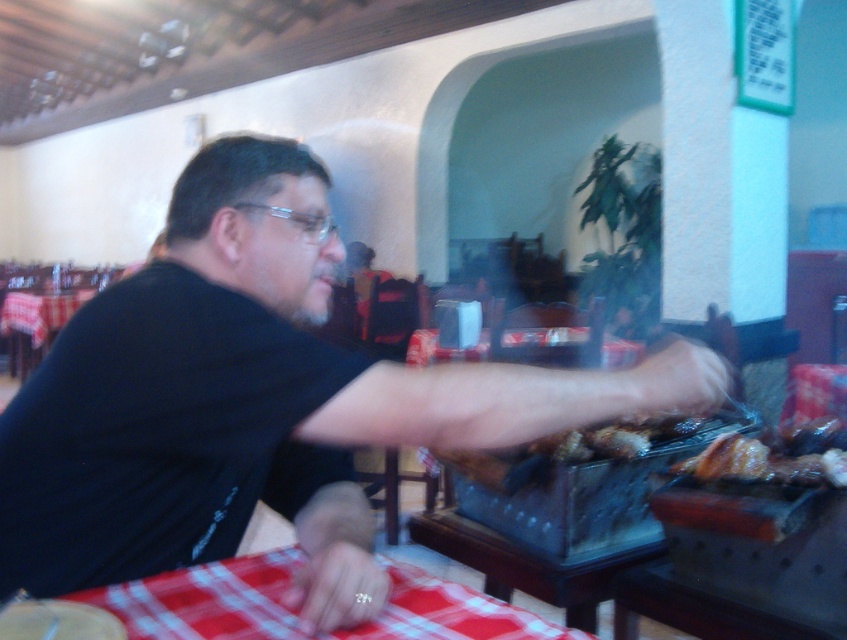
Question: Which point appears farthest from the camera in this image?

Choices:
 (A) (754, 452)
 (B) (640, 432)
 (C) (197, 596)
 (D) (37, 339)

Answer: (D)

Question: Does black matte shirt at center have a lesser width compared to red checkered tablecloth at lower center?

Choices:
 (A) yes
 (B) no

Answer: (B)

Question: Which point is closer to the camera?

Choices:
 (A) transparent plastic glasses at center
 (B) black matte shirt at center
 (C) red checkered tablecloth at left
 (D) brown crispy meat at center

Answer: (B)

Question: Which object is positioned farthest from the red checkered tablecloth at lower center?

Choices:
 (A) brown crispy meat at center
 (B) black matte shirt at center
 (C) transparent plastic glasses at center
 (D) red checkered tablecloth at left

Answer: (D)

Question: Is the position of red checkered tablecloth at lower center more distant than that of transparent plastic glasses at center?

Choices:
 (A) yes
 (B) no

Answer: (B)

Question: Where is black matte shirt at center located in relation to brown crispy meat at center in the image?

Choices:
 (A) below
 (B) above

Answer: (B)